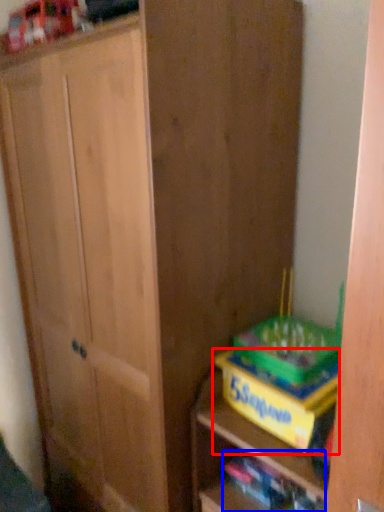
Question: Among these objects, which one is farthest to the camera, cabinetry (highlighted by a red box) or book (highlighted by a blue box)?

Choices:
 (A) cabinetry
 (B) book

Answer: (B)